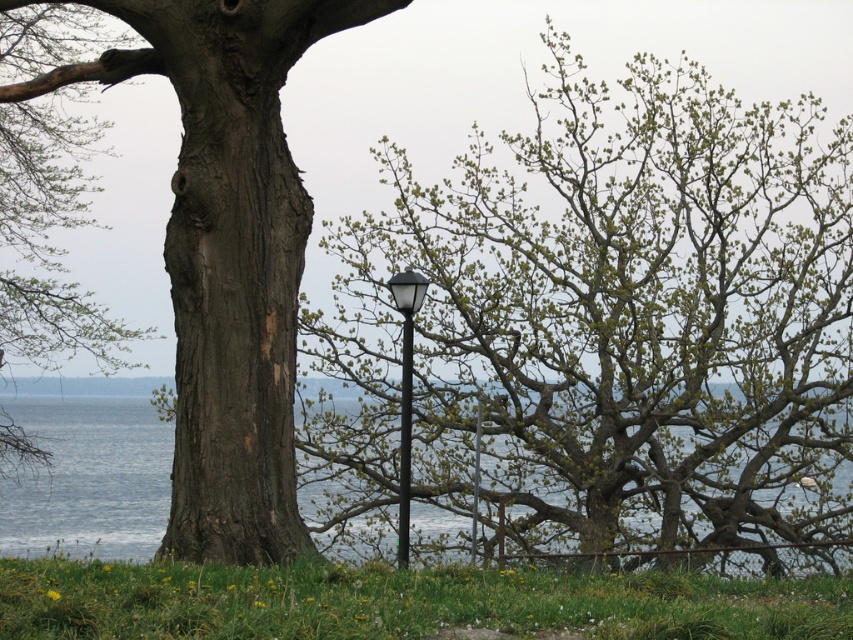
You are standing in the outdoor scene looking at the tree trunk and the lamppost. There are two points marked in the image. Which point, point (287,369) or point (45,536), is closer to you?

Point (287,369) is closer to the viewer than point (45,536).

You are standing at the point marked as point (602,324) in the image. Looking around, you see a green leafy tree at center. Which direction should you walk to reach the black lamppost with a classic design?

The green leafy tree at center is located at point (602,324), so you are already at the location of the green leafy tree at center. To reach the black lamppost with a classic design, you should walk towards the middle ground where the lamppost stands on the grassy area.